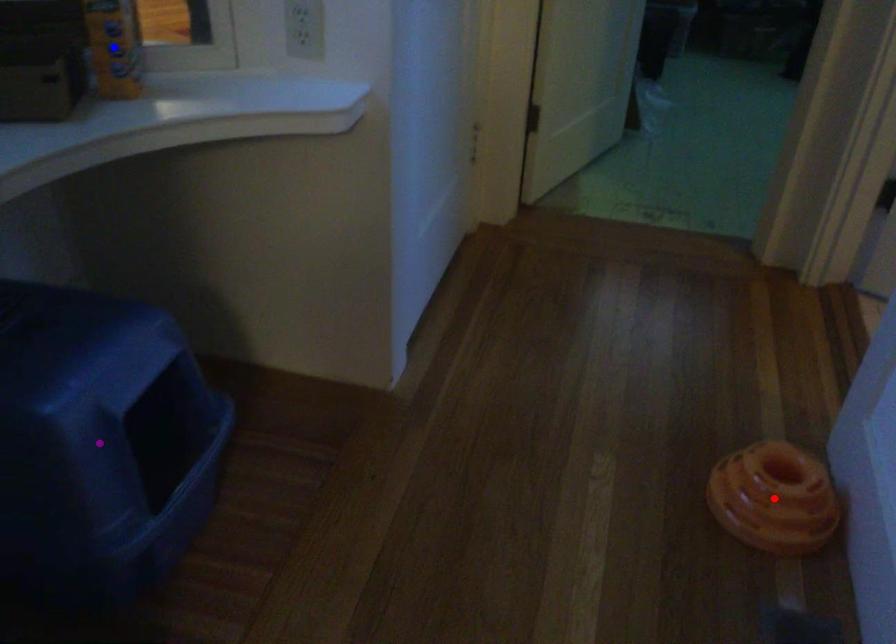
Order these from nearest to farthest:
A) red point
B) blue point
C) purple point

red point, blue point, purple point